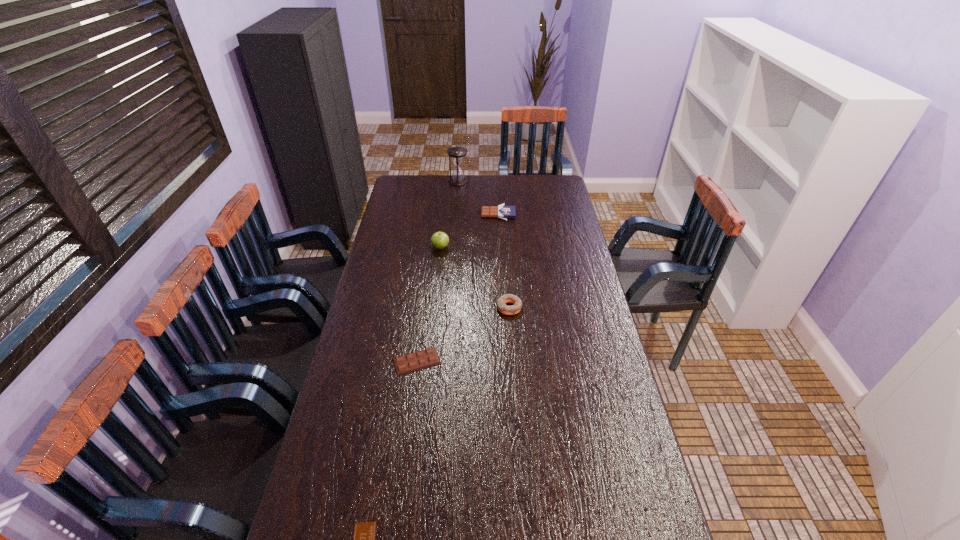
I want to click on vacant region located 0.140m on the left of the farthest object, so click(422, 181).

You are a GUI agent. You are given a task and a screenshot of the screen. Output one action in this format:
    pyautogui.click(x=<x>, y=<y>)
    Task: Click on the free space located on the front of the second tallest object
    
    Given the screenshot: What is the action you would take?
    pyautogui.click(x=437, y=275)

The width and height of the screenshot is (960, 540). I want to click on free location located on the back of the doughnut, so click(507, 277).

Identify the location of free space located 0.100m on the front of the fifth nearest object. (499, 233).

At what (x,y) coordinates should I click in order to perform the action: click on vacant space located on the front of the second shortest chocolate bar. Please return your answer as a coordinate pair (x, y). Looking at the image, I should click on (409, 420).

Locate an element on the screen. The width and height of the screenshot is (960, 540). object present at the far edge is located at coordinates (457, 154).

Where is `object located in the left edge section of the desktop`? The width and height of the screenshot is (960, 540). object located in the left edge section of the desktop is located at coordinates (422, 359).

Where is `vacant space at the far edge`? vacant space at the far edge is located at coordinates (491, 179).

This screenshot has width=960, height=540. Identify the location of vacant space at the left edge of the desktop. (372, 267).

This screenshot has width=960, height=540. I want to click on free space at the right edge of the desktop, so click(628, 533).